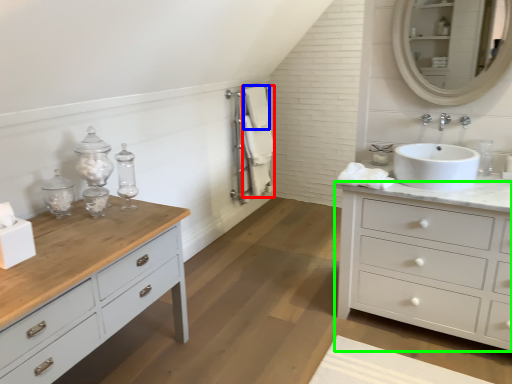
Question: Which object is the farthest from bath towel (highlighted by a red box)? Choose among these: bath towel (highlighted by a blue box) or chest of drawers (highlighted by a green box).

Choices:
 (A) bath towel
 (B) chest of drawers

Answer: (B)